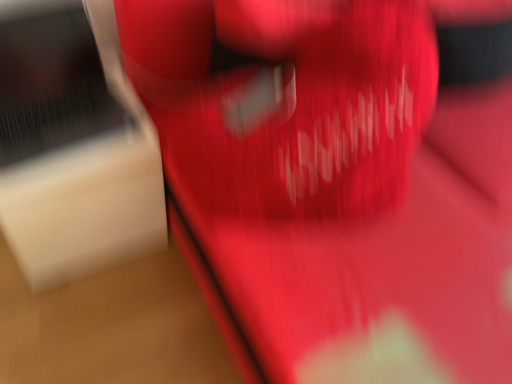
What is the approximate height of glossy fabric face at center?

glossy fabric face at center is 36.01 centimeters tall.

Where is `glossy fabric face at center`? glossy fabric face at center is located at coordinates (285, 100).

The width and height of the screenshot is (512, 384). Describe the element at coordinates (285, 100) in the screenshot. I see `glossy fabric face at center` at that location.

Where is `glossy fabric face at center`? glossy fabric face at center is located at coordinates pos(285,100).